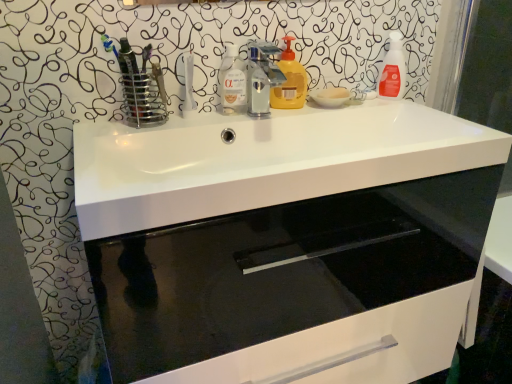
Locate an element on the screen. Image resolution: width=512 pixels, height=384 pixels. free region on the left part of yellow matte liquid soap at center, marked as the second cleaning product in a left-to-right arrangement is located at coordinates (226, 114).